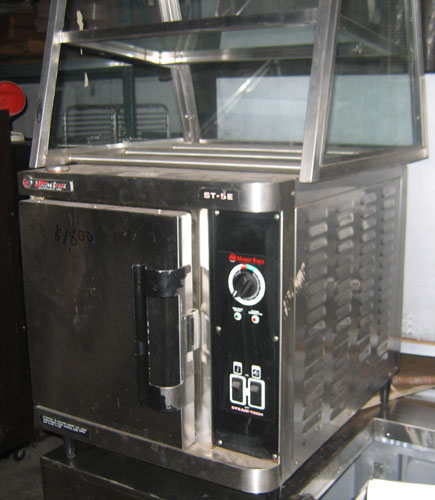
The height and width of the screenshot is (500, 435). Find the location of `side panels`. side panels is located at coordinates [318, 215], [348, 204], [370, 195], [390, 192].